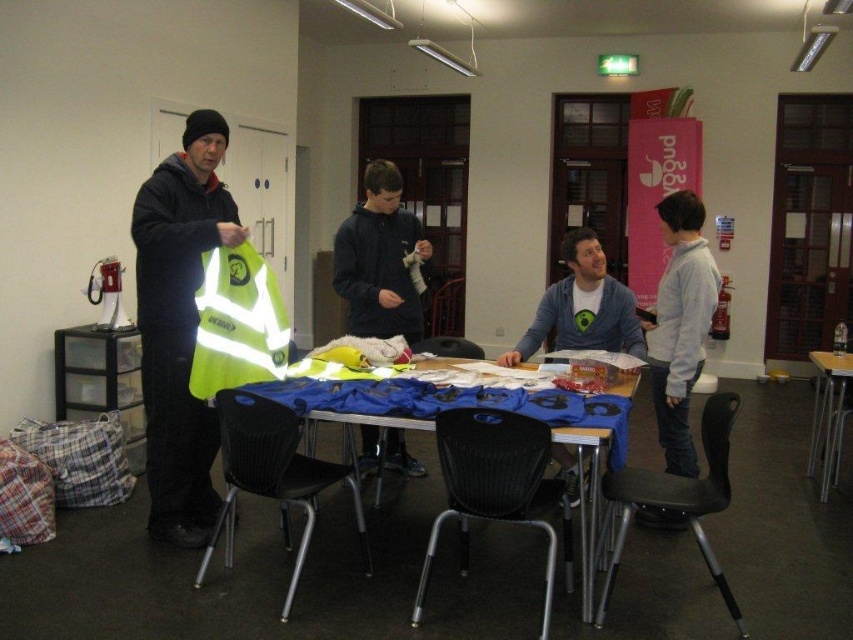
You are organizing a safety workshop and need to place the reflective fabric high visibility vest at left and the black plastic chair at lower center in a specific arrangement. According to the image, which object is positioned to the left of the other?

The reflective fabric high visibility vest at left is to the left of the black plastic chair at lower center.

You are a delivery person who needs to place a package on the table between the reflective fabric high visibility vest at left and the black plastic chair at lower center. The package is 22 inches long. Can you fit it there?

The reflective fabric high visibility vest at left and black plastic chair at lower center are 21.63 inches apart from each other. Since the package is 22 inches long, it will not fit between them as the space is slightly smaller than the package.